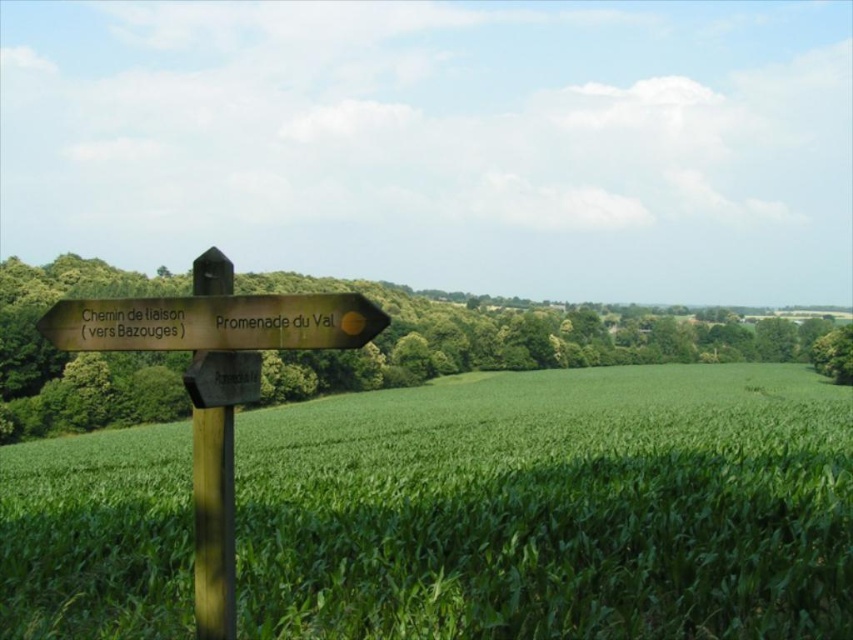
You are standing at the base of the wooden post at left and want to walk towards the green grassy field at center. In which direction should you go relative to the post?

The green grassy field at center is located below the wooden post at left, so you should walk downward from the wooden post at left to reach the green grassy field at center.

You are standing at the wooden signpost at left and want to walk towards the wooden post at left. Which direction should you face to move directly towards it?

You should face towards the direction the wooden signpost at left is pointing, which is to the left, to move directly towards the wooden post at left since it is in front of it.